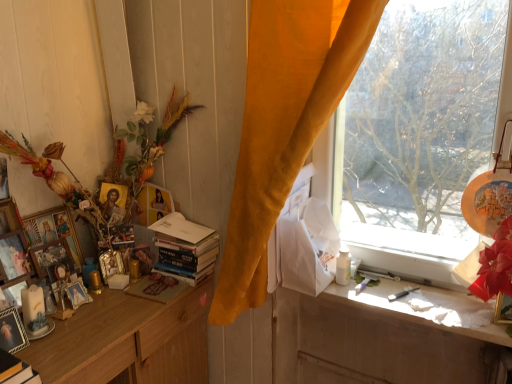
Identify the location of empty space that is ontop of matte brown magazine at center (from a real-world perspective). (157, 288).